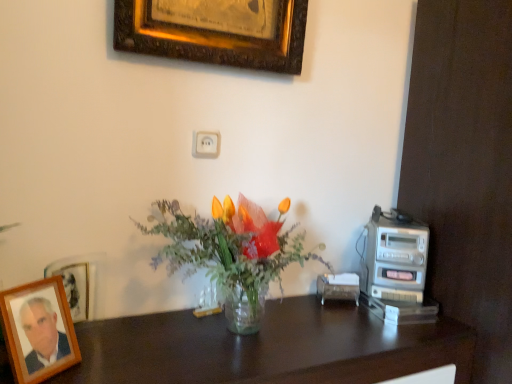
This screenshot has width=512, height=384. What are the coordinates of `vacant space in transparent glass vase at center (from a real-world perspective)` in the screenshot? It's located at (229, 335).